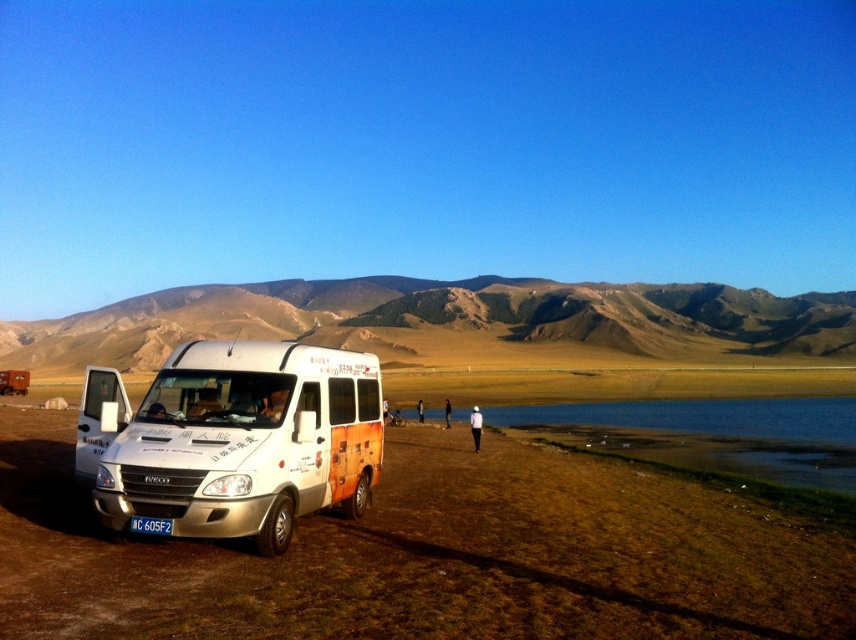
Between white matte van at lower left and black fabric person at center, which one appears on the left side from the viewer's perspective?

white matte van at lower left is more to the left.

Can you confirm if white matte van at lower left is positioned below black fabric person at center?

Actually, white matte van at lower left is above black fabric person at center.

The width and height of the screenshot is (856, 640). Identify the location of white matte van at lower left. (244, 442).

What are the coordinates of `white matte van at lower left` in the screenshot? It's located at (244, 442).

Between white plastic license plate at lower center and black fabric person at center, which one appears on the right side from the viewer's perspective?

Positioned to the right is black fabric person at center.

Can you confirm if white plastic license plate at lower center is wider than black fabric person at center?

Incorrect, white plastic license plate at lower center's width does not surpass black fabric person at center's.

Which is in front, point (165, 532) or point (449, 412)?

Point (165, 532) is in front.

I want to click on white plastic license plate at lower center, so click(x=152, y=525).

Which is behind, point (486, 573) or point (298, 371)?

The point (298, 371) is behind.

Is point (734, 552) more distant than point (150, 385)?

Yes, it is behind point (150, 385).

Image resolution: width=856 pixels, height=640 pixels. What are the coordinates of `brown dirt field at lower left` in the screenshot? It's located at (429, 554).